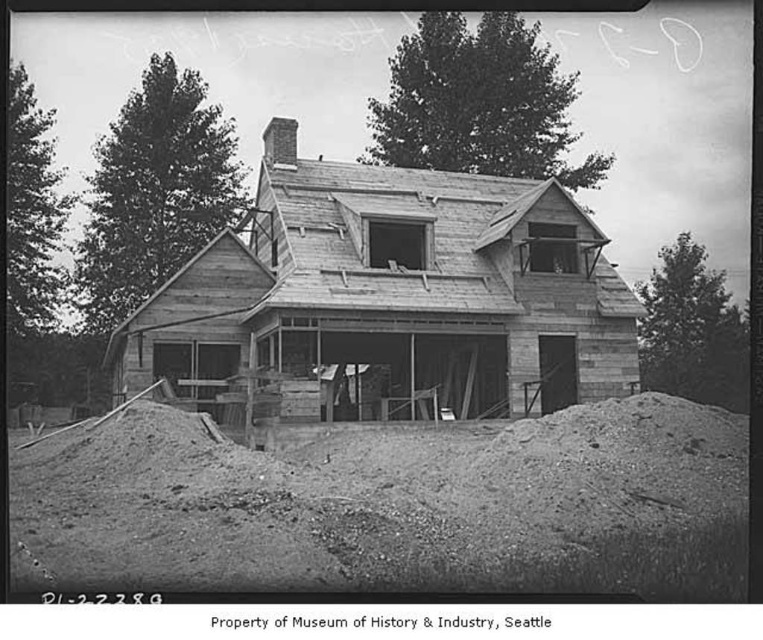
Is loose gravel at lower center thinner than wooden house at center?

Yes.

Find the location of a particular element. loose gravel at lower center is located at coordinates (401, 504).